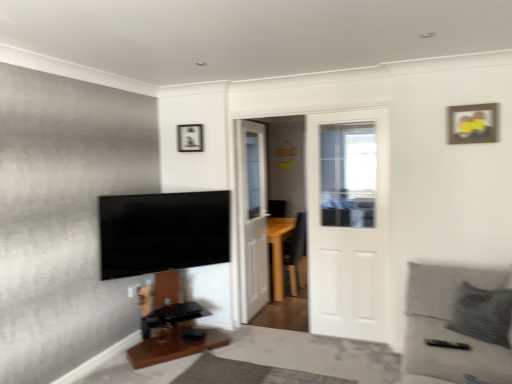
Question: Is wooden picture frame at upper right, positioned as the second picture frame in left-to-right order, at the right side of wooden table at lower center?

Choices:
 (A) yes
 (B) no

Answer: (A)

Question: From the image's perspective, is wooden picture frame at upper right, which appears as the first picture frame when viewed from the front, over wooden table at lower center?

Choices:
 (A) yes
 (B) no

Answer: (A)

Question: Could wooden table at lower center be considered to be inside wooden picture frame at upper right, positioned as the second picture frame in left-to-right order?

Choices:
 (A) yes
 (B) no

Answer: (B)

Question: From a real-world perspective, is wooden picture frame at upper right, which appears as the first picture frame when viewed from the front, below wooden table at lower center?

Choices:
 (A) yes
 (B) no

Answer: (B)

Question: Is wooden picture frame at upper right, positioned as the second picture frame in left-to-right order, aimed at wooden table at lower center?

Choices:
 (A) yes
 (B) no

Answer: (B)

Question: Looking at their shapes, would you say wooden picture frame at upper center, the second picture frame from the front, is wider or thinner than white wooden door at center, which is the 1th door in back-to-front order?

Choices:
 (A) thin
 (B) wide

Answer: (A)

Question: From the image's perspective, is wooden picture frame at upper center, which ranks as the second picture frame in right-to-left order, above or below white wooden door at center, acting as the 2th door starting from the front?

Choices:
 (A) above
 (B) below

Answer: (A)

Question: Based on their positions, is wooden picture frame at upper center, which is counted as the 1th picture frame, starting from the left, located to the left or right of white wooden door at center, the 2th door viewed from the right?

Choices:
 (A) right
 (B) left

Answer: (B)

Question: Based on their sizes in the image, would you say wooden picture frame at upper center, the first picture frame from the back, is bigger or smaller than white wooden door at center, the 2th door viewed from the right?

Choices:
 (A) small
 (B) big

Answer: (A)

Question: Would you say flat screen tv at left is to the left or to the right of white wooden door at center, the 2th door when ordered from back to front, in the picture?

Choices:
 (A) left
 (B) right

Answer: (A)

Question: Considering their positions, is flat screen tv at left located in front of or behind white wooden door at center, the first door in the front-to-back sequence?

Choices:
 (A) behind
 (B) front

Answer: (B)

Question: From a real-world perspective, is flat screen tv at left above or below white wooden door at center, the 1th door when ordered from right to left?

Choices:
 (A) above
 (B) below

Answer: (B)

Question: From the image's perspective, is flat screen tv at left positioned above or below white wooden door at center, the first door in the front-to-back sequence?

Choices:
 (A) above
 (B) below

Answer: (B)

Question: Based on their sizes in the image, would you say white wooden door at center, acting as the 2th door starting from the front, is bigger or smaller than wooden picture frame at upper center, which ranks as the second picture frame in right-to-left order?

Choices:
 (A) small
 (B) big

Answer: (B)

Question: Would you say white wooden door at center, which is the 1th door in back-to-front order, is to the left or to the right of wooden picture frame at upper center, which ranks as the second picture frame in right-to-left order, in the picture?

Choices:
 (A) right
 (B) left

Answer: (A)